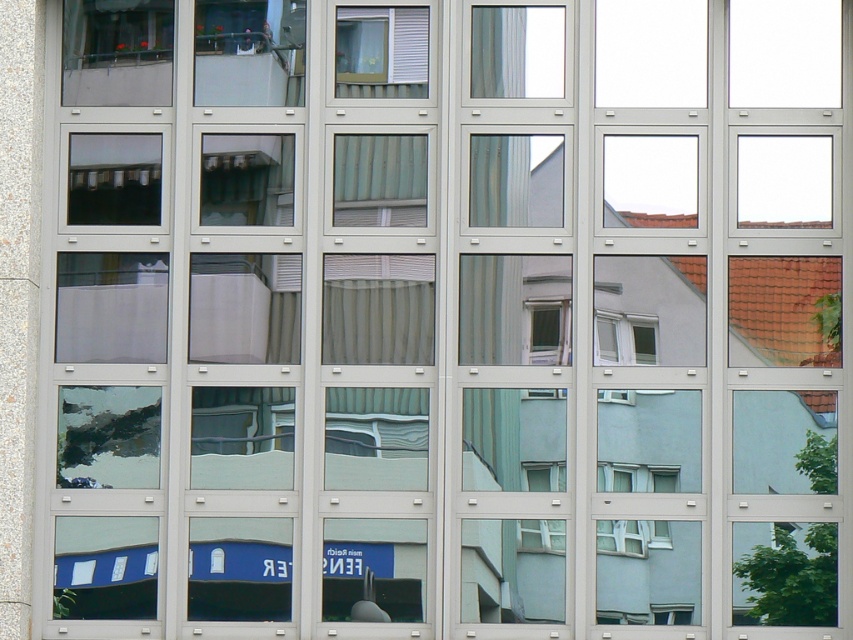
Does white matte blinds at upper center appear under white glossy window at center-right?

No, white matte blinds at upper center is not below white glossy window at center-right.

Can you confirm if white matte blinds at upper center is positioned above white glossy window at center-right?

Yes.

Between point (395, 35) and point (634, 355), which one is positioned in front?

Point (634, 355) is in front.

Identify the location of white matte blinds at upper center. This screenshot has height=640, width=853. (381, 45).